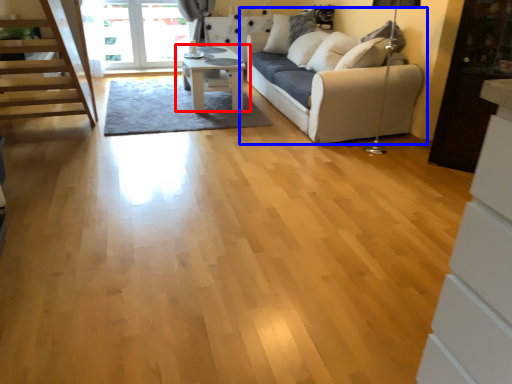
Question: Among these objects, which one is farthest to the camera, table (highlighted by a red box) or studio couch (highlighted by a blue box)?

Choices:
 (A) table
 (B) studio couch

Answer: (A)